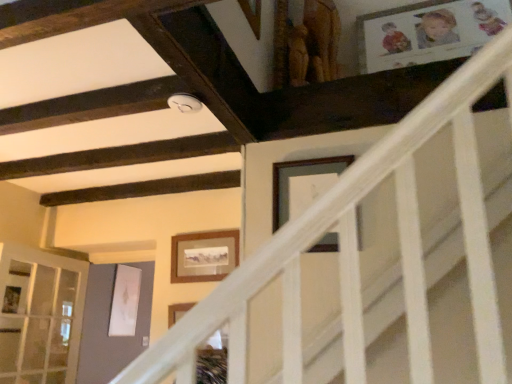
Question: Does clear glass door at lower left lie in front of wooden picture frame at upper center, the 1th picture frame positioned from the right?

Choices:
 (A) no
 (B) yes

Answer: (A)

Question: Is clear glass door at lower left oriented away from wooden picture frame at upper center, which ranks as the second picture frame in back-to-front order?

Choices:
 (A) no
 (B) yes

Answer: (A)

Question: Is the position of clear glass door at lower left more distant than that of wooden picture frame at upper center, which is the 1th picture frame in front-to-back order?

Choices:
 (A) no
 (B) yes

Answer: (B)

Question: From the image's perspective, is clear glass door at lower left above wooden picture frame at upper center, which is the second picture frame from left to right?

Choices:
 (A) no
 (B) yes

Answer: (A)

Question: Does clear glass door at lower left have a larger size compared to wooden picture frame at upper center, placed as the first picture frame when sorted from top to bottom?

Choices:
 (A) no
 (B) yes

Answer: (B)

Question: Can you confirm if clear glass door at lower left is shorter than wooden picture frame at upper center, which ranks as the 2th picture frame in bottom-to-top order?

Choices:
 (A) yes
 (B) no

Answer: (B)

Question: Would you say clear glass door at lower left is outside wooden framed picture at center, which ranks as the 1th picture frame in back-to-front order?

Choices:
 (A) no
 (B) yes

Answer: (B)

Question: Does clear glass door at lower left appear on the right side of wooden framed picture at center, the 2th picture frame viewed from the front?

Choices:
 (A) no
 (B) yes

Answer: (A)

Question: From a real-world perspective, is clear glass door at lower left physically above wooden framed picture at center, the 1th picture frame from the bottom?

Choices:
 (A) yes
 (B) no

Answer: (B)

Question: Does clear glass door at lower left have a lesser height compared to wooden framed picture at center, which appears as the second picture frame when viewed from the right?

Choices:
 (A) yes
 (B) no

Answer: (B)

Question: From a real-world perspective, is clear glass door at lower left located beneath wooden framed picture at center, arranged as the second picture frame when viewed from the top?

Choices:
 (A) no
 (B) yes

Answer: (B)

Question: Is clear glass door at lower left further to camera compared to wooden framed picture at center, which ranks as the 1th picture frame in back-to-front order?

Choices:
 (A) yes
 (B) no

Answer: (B)

Question: Is wooden framed picture at center, which ranks as the 1th picture frame in back-to-front order, positioned before wooden picture frame at upper center, which ranks as the 2th picture frame in bottom-to-top order?

Choices:
 (A) yes
 (B) no

Answer: (B)